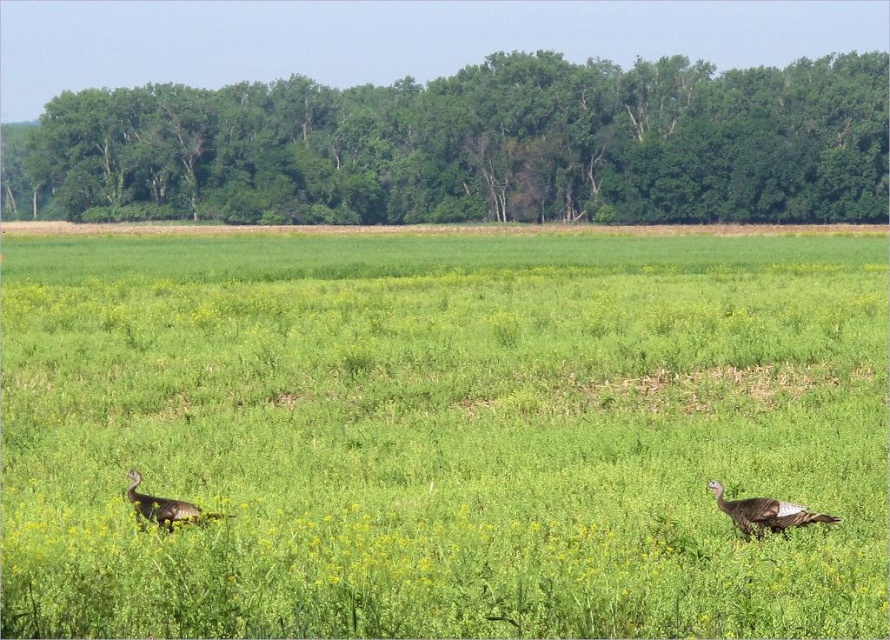
Question: Which is farther from the grayish-brown feathers at lower right?

Choices:
 (A) green grassy field at center
 (B) brown feathered turkey at lower left

Answer: (A)

Question: Can you confirm if green grassy field at center is bigger than brown feathered turkey at lower left?

Choices:
 (A) no
 (B) yes

Answer: (B)

Question: Does green grassy field at center lie in front of brown feathered turkey at lower left?

Choices:
 (A) no
 (B) yes

Answer: (B)

Question: Is grayish-brown feathers at lower right closer to the viewer compared to brown feathered turkey at lower left?

Choices:
 (A) yes
 (B) no

Answer: (B)

Question: Which of these objects is positioned farthest from the grayish-brown feathers at lower right?

Choices:
 (A) brown feathered turkey at lower left
 (B) green grassy field at center

Answer: (B)

Question: Which object appears farthest from the camera in this image?

Choices:
 (A) grayish-brown feathers at lower right
 (B) brown feathered turkey at lower left
 (C) green grassy field at center

Answer: (A)